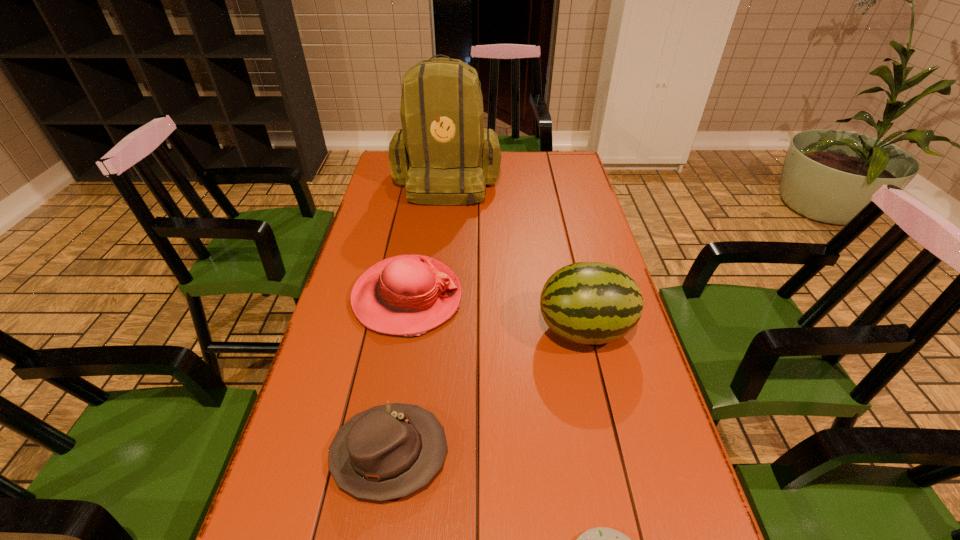
At what (x,y) coordinates should I click in order to perform the action: click on free space located 0.240m at the stem end of the fourth shortest object. Please return your answer as a coordinate pair (x, y). Looking at the image, I should click on (444, 330).

What are the coordinates of `vacant space located at the front of the farther hat with a bow` in the screenshot? It's located at (513, 298).

You are a GUI agent. You are given a task and a screenshot of the screen. Output one action in this format:
    pyautogui.click(x=<x>, y=<y>)
    Task: Click on the vacant space situated 0.330m on the decorative side of the nearer hat
    Image resolution: width=960 pixels, height=540 pixels.
    Given the screenshot: What is the action you would take?
    pyautogui.click(x=610, y=454)

The width and height of the screenshot is (960, 540). Find the location of `object that is at the far edge`. object that is at the far edge is located at coordinates (443, 154).

Locate an element on the screen. This screenshot has height=540, width=960. backpack present at the left edge is located at coordinates (443, 154).

Where is `object that is at the right edge`? The image size is (960, 540). object that is at the right edge is located at coordinates (591, 303).

At what (x,y) coordinates should I click in order to perform the action: click on object positioned at the far left corner. Please return your answer as a coordinate pair (x, y). Looking at the image, I should click on (443, 154).

Where is `free space at the left edge of the desktop`? free space at the left edge of the desktop is located at coordinates (299, 496).

This screenshot has width=960, height=540. I want to click on free space at the right edge, so click(x=627, y=381).

In the image, there is a desktop. Identify the location of vacant space at the far right corner. (575, 177).